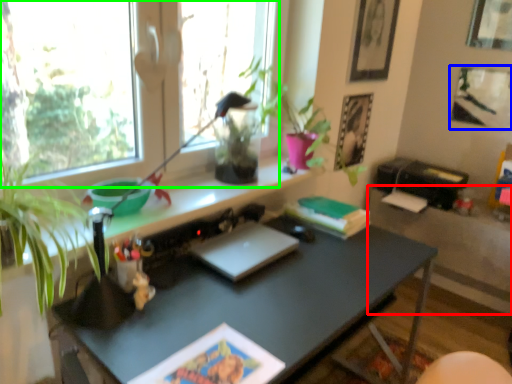
Question: Estimate the real-world distances between objects in this image. Which object is closer to table (highlighted by a red box), picture frame (highlighted by a blue box) or window (highlighted by a green box)?

Choices:
 (A) picture frame
 (B) window

Answer: (A)